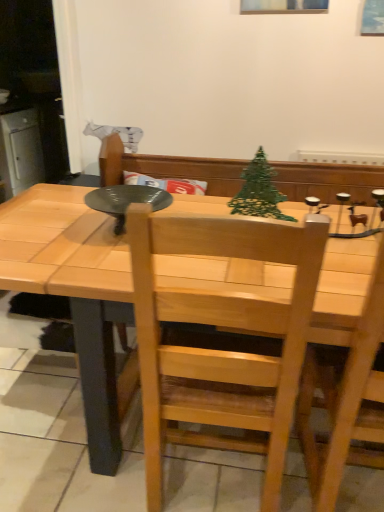
Describe the element at coordinates (219, 348) in the screenshot. Image resolution: width=384 pixels, height=512 pixels. I see `natural wood chair at center` at that location.

What do you see at coordinates (75, 292) in the screenshot? The height and width of the screenshot is (512, 384). I see `natural wood table at center` at bounding box center [75, 292].

I want to click on natural wood chair at center, so click(219, 348).

Considering their positions, is natural wood chair at center located in front of or behind green wire christmas tree at center?

Clearly, natural wood chair at center is in front of green wire christmas tree at center.

Between point (142, 399) and point (262, 184), which one is positioned in front?

The point (142, 399) is closer to the camera.

From the picture: From the image's perspective, is natural wood chair at center located beneath green wire christmas tree at center?

Yes.

Considering the relative positions of natural wood chair at center and natural wood table at center in the image provided, is natural wood chair at center to the left or to the right of natural wood table at center?

natural wood chair at center is to the right of natural wood table at center.

From the image's perspective, is natural wood chair at center located above or below natural wood table at center?

natural wood chair at center is situated lower than natural wood table at center in the image.

Consider the image. Who is more distant, natural wood chair at center or natural wood table at center?

natural wood table at center.

Between point (40, 193) and point (223, 446), which one is positioned in front?

Point (223, 446)

From the image's perspective, between natural wood table at center and natural wood chair at center, who is located below?

natural wood chair at center, from the image's perspective.

Could you tell me if natural wood table at center is facing natural wood chair at center?

Yes, natural wood table at center is turned towards natural wood chair at center.

Which object is positioned more to the right, green wire christmas tree at center or natural wood chair at center?

Positioned to the right is green wire christmas tree at center.

From a real-world perspective, is green wire christmas tree at center physically below natural wood chair at center?

No.

From the image's perspective, relative to natural wood chair at center, is green wire christmas tree at center above or below?

Based on their image positions, green wire christmas tree at center is located above natural wood chair at center.

Locate an element on the screen. christmas tree located above the natural wood chair at center (from the image's perspective) is located at coordinates [259, 191].

Does natural wood table at center have a smaller size compared to green wire christmas tree at center?

No, natural wood table at center is not smaller than green wire christmas tree at center.

Is the position of natural wood table at center more distant than that of green wire christmas tree at center?

No, natural wood table at center is closer to the viewer.

Which is correct: natural wood table at center is inside green wire christmas tree at center, or outside of it?

natural wood table at center exists outside the volume of green wire christmas tree at center.

Is natural wood table at center oriented away from green wire christmas tree at center?

That's not correct — natural wood table at center is not looking away from green wire christmas tree at center.

Is green wire christmas tree at center completely or partially outside of natural wood table at center?

Yes, green wire christmas tree at center is not within natural wood table at center.

Between green wire christmas tree at center and natural wood table at center, which one has smaller width?

green wire christmas tree at center.

Can you confirm if green wire christmas tree at center is taller than natural wood table at center?

In fact, green wire christmas tree at center may be shorter than natural wood table at center.

Can you tell me how much green wire christmas tree at center and natural wood table at center differ in facing direction?

There is a 15.4-degree angle between the facing directions of green wire christmas tree at center and natural wood table at center.

This screenshot has height=512, width=384. What are the coordinates of `christmas tree above the natural wood chair at center (from a real-world perspective)` in the screenshot? It's located at (259, 191).

Locate an element on the screen. This screenshot has height=512, width=384. table below the natural wood chair at center (from a real-world perspective) is located at coordinates (75, 292).

Which object lies further to the anchor point natural wood chair at center, green wire christmas tree at center or natural wood table at center?

green wire christmas tree at center is further to natural wood chair at center.

Based on their spatial positions, is natural wood chair at center or natural wood table at center closer to green wire christmas tree at center?

natural wood table at center lies closer to green wire christmas tree at center than the other object.

Looking at the image, which one is located closer to green wire christmas tree at center, natural wood table at center or natural wood chair at center?

Among the two, natural wood table at center is located nearer to green wire christmas tree at center.

Based on their spatial positions, is natural wood table at center or green wire christmas tree at center further from natural wood chair at center?

green wire christmas tree at center is positioned further to the anchor natural wood chair at center.

Looking at the image, which one is located further to natural wood table at center, green wire christmas tree at center or natural wood chair at center?

green wire christmas tree at center is positioned further to the anchor natural wood table at center.

Estimate the real-world distances between objects in this image. Which object is further from natural wood table at center, natural wood chair at center or green wire christmas tree at center?

Based on the image, green wire christmas tree at center appears to be further to natural wood table at center.

This screenshot has height=512, width=384. In order to click on table between green wire christmas tree at center and natural wood chair at center vertically in this screenshot , I will do `click(75, 292)`.